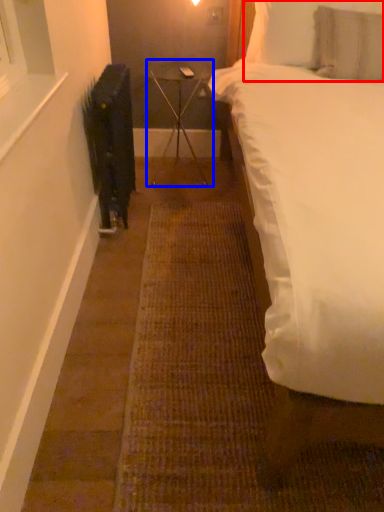
Question: Among these objects, which one is farthest to the camera, pillow (highlighted by a red box) or table (highlighted by a blue box)?

Choices:
 (A) pillow
 (B) table

Answer: (B)